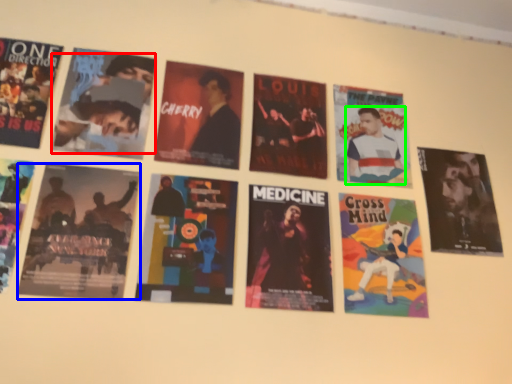
Question: Which object is positioned farthest from person (highlighted by a red box)? Select from poster (highlighted by a blue box) and person (highlighted by a green box).

Choices:
 (A) poster
 (B) person

Answer: (B)